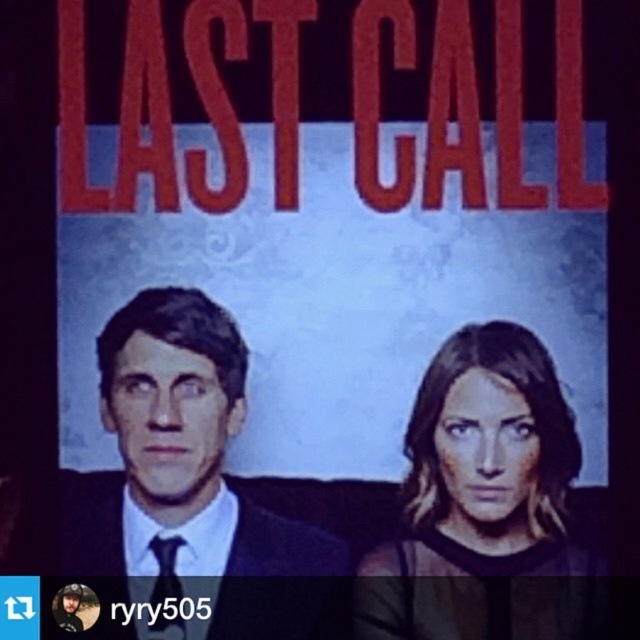
Question: Can you confirm if matte black suit at left is wider than smooth brown hair at center?

Choices:
 (A) yes
 (B) no

Answer: (A)

Question: Considering the relative positions of matte black suit at left and smooth brown hair at center in the image provided, where is matte black suit at left located with respect to smooth brown hair at center?

Choices:
 (A) right
 (B) left

Answer: (B)

Question: Where is matte black suit at left located in relation to smooth brown hair at center in the image?

Choices:
 (A) right
 (B) left

Answer: (B)

Question: Which point is closer to the camera taking this photo?

Choices:
 (A) (224, 401)
 (B) (477, 624)

Answer: (B)